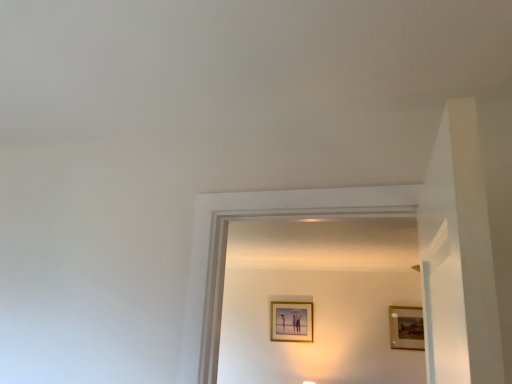
Locate an element on the screen. This screenshot has width=512, height=384. gold wooden picture frame at center is located at coordinates (291, 321).

What do you see at coordinates (291, 321) in the screenshot? The height and width of the screenshot is (384, 512). I see `gold wooden picture frame at center` at bounding box center [291, 321].

I want to click on gold wooden picture frame at center, so point(291,321).